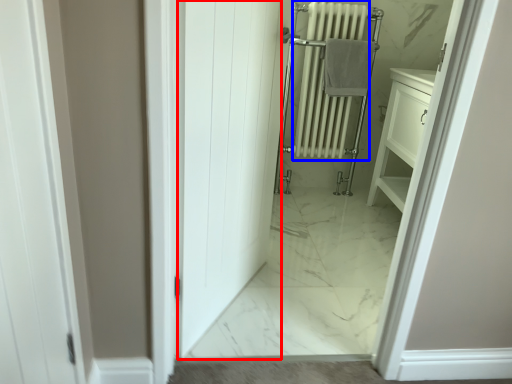
Question: Among these objects, which one is farthest to the camera, door (highlighted by a red box) or radiator (highlighted by a blue box)?

Choices:
 (A) door
 (B) radiator

Answer: (B)